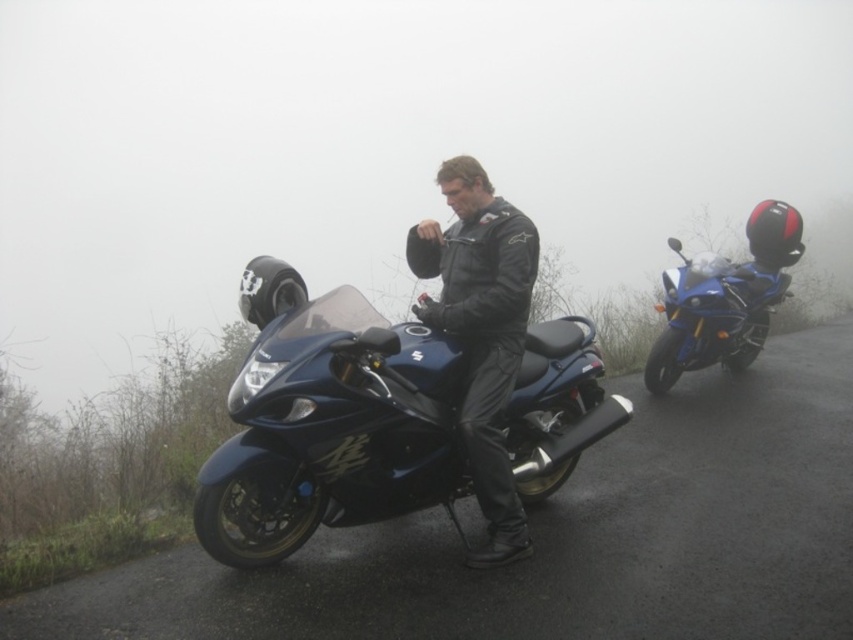
You are a photographer trying to capture a wide shot of the scene. The glossy black motorcycle at center and the black leather jacket at center are both in your frame. Given that the motorcycle is wider than the jacket, which object will require more horizontal space in your photo to fully capture?

The glossy black motorcycle at center requires more horizontal space in the photo because its width is larger than the black leather jacket at center.